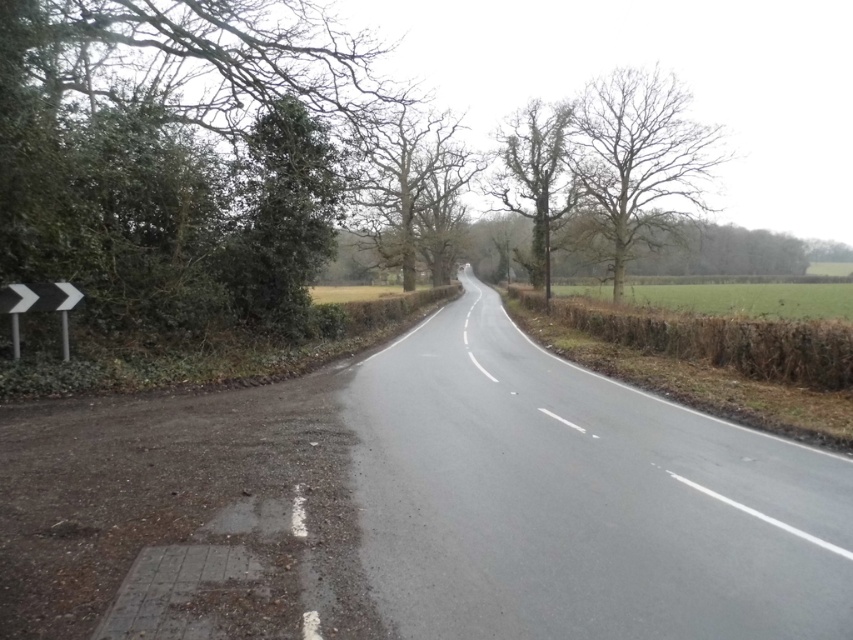
Measure the distance from bare wood tree at upper right to white plastic arrow at left.

A distance of 133.40 feet exists between bare wood tree at upper right and white plastic arrow at left.

Who is higher up, bare wood tree at upper right or white plastic arrow at left?

Positioned higher is bare wood tree at upper right.

Is point (578, 134) positioned behind point (9, 314)?

Yes, it is.

Locate an element on the screen. This screenshot has width=853, height=640. bare wood tree at upper right is located at coordinates (637, 160).

Does bare branches at center appear on the left side of green leafy tree at center?

Yes, bare branches at center is to the left of green leafy tree at center.

Who is lower down, bare branches at center or green leafy tree at center?

green leafy tree at center is below.

Does point (370, 221) come behind point (540, 196)?

Yes, point (370, 221) is behind point (540, 196).

The height and width of the screenshot is (640, 853). What are the coordinates of `bare branches at center` in the screenshot? It's located at (409, 186).

Can you confirm if bare wood tree at upper right is wider than green leafy tree at center?

Yes, bare wood tree at upper right is wider than green leafy tree at center.

Looking at this image, can you confirm if bare wood tree at upper right is thinner than green leafy tree at center?

In fact, bare wood tree at upper right might be wider than green leafy tree at center.

Who is more distant from viewer, (577, 164) or (564, 145)?

Point (577, 164)

This screenshot has width=853, height=640. What are the coordinates of `bare wood tree at upper right` in the screenshot? It's located at (637, 160).